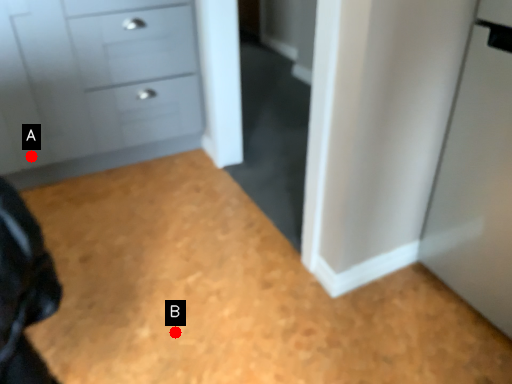
Question: Two points are circled on the image, labeled by A and B beside each circle. Which point is closer to the camera?

Choices:
 (A) A is closer
 (B) B is closer

Answer: (B)